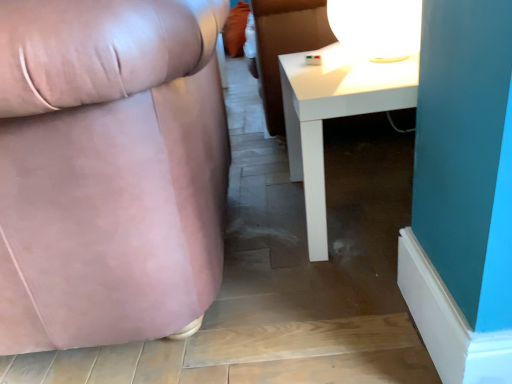
Question: Is matte pink fabric chair at left outside white glossy table at lower right?

Choices:
 (A) no
 (B) yes

Answer: (B)

Question: Is matte pink fabric chair at left smaller than white glossy table at lower right?

Choices:
 (A) yes
 (B) no

Answer: (B)

Question: Is the position of matte pink fabric chair at left more distant than that of white glossy table at lower right?

Choices:
 (A) no
 (B) yes

Answer: (A)

Question: Can you see matte pink fabric chair at left touching white glossy table at lower right?

Choices:
 (A) no
 (B) yes

Answer: (A)

Question: Is matte pink fabric chair at left bigger than white glossy table at lower right?

Choices:
 (A) yes
 (B) no

Answer: (A)

Question: In terms of width, does white glossy table at lower right look wider or thinner when compared to white glossy table lamp at upper right?

Choices:
 (A) wide
 (B) thin

Answer: (A)

Question: From a real-world perspective, relative to white glossy table lamp at upper right, is white glossy table at lower right vertically above or below?

Choices:
 (A) above
 (B) below

Answer: (B)

Question: Visually, is white glossy table at lower right positioned to the left or to the right of white glossy table lamp at upper right?

Choices:
 (A) right
 (B) left

Answer: (A)

Question: From their relative heights in the image, would you say white glossy table at lower right is taller or shorter than white glossy table lamp at upper right?

Choices:
 (A) short
 (B) tall

Answer: (B)

Question: From the image's perspective, is white glossy table at lower right positioned above or below matte pink fabric chair at left?

Choices:
 (A) below
 (B) above

Answer: (B)

Question: Is white glossy table at lower right to the left or to the right of matte pink fabric chair at left in the image?

Choices:
 (A) left
 (B) right

Answer: (B)

Question: In terms of size, does white glossy table at lower right appear bigger or smaller than matte pink fabric chair at left?

Choices:
 (A) big
 (B) small

Answer: (B)

Question: Considering the positions of point (316, 52) and point (168, 253), is point (316, 52) closer or farther from the camera than point (168, 253)?

Choices:
 (A) closer
 (B) farther

Answer: (B)

Question: Which is correct: matte pink fabric chair at left is inside white glossy table lamp at upper right, or outside of it?

Choices:
 (A) inside
 (B) outside

Answer: (B)

Question: Considering the positions of matte pink fabric chair at left and white glossy table lamp at upper right in the image, is matte pink fabric chair at left taller or shorter than white glossy table lamp at upper right?

Choices:
 (A) tall
 (B) short

Answer: (A)